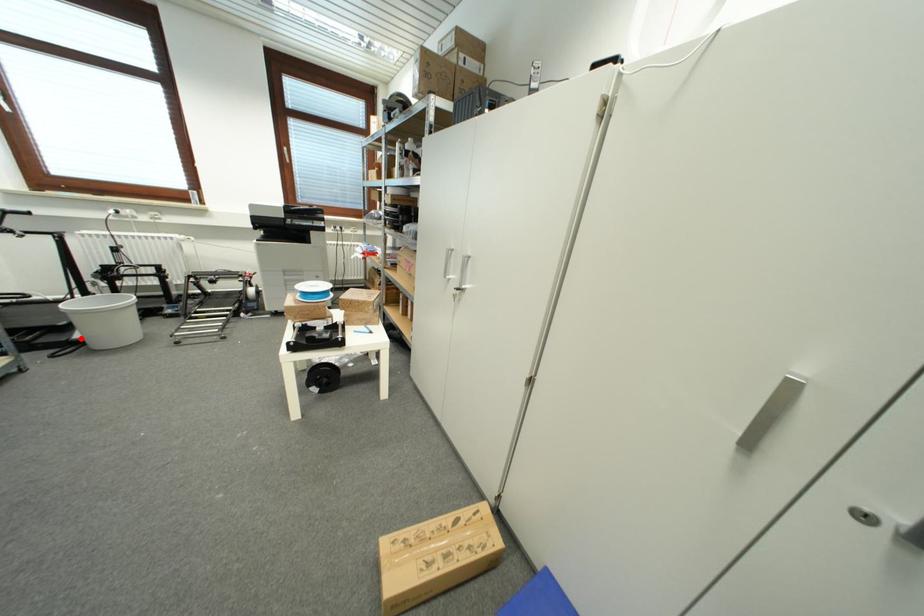
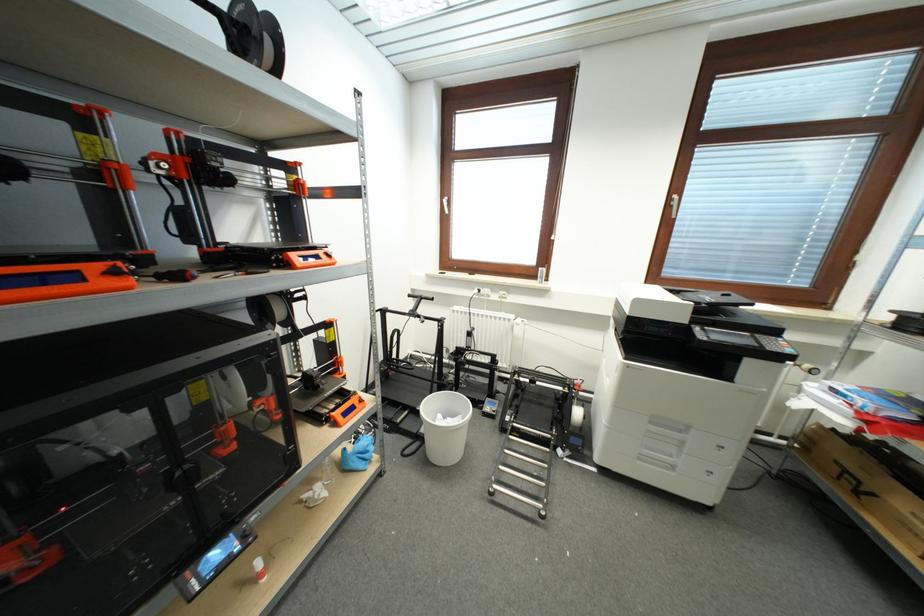
Question: I am providing you with two images of the same scene from different viewpoints. A red point is shown in image1. For the corresponding object point in image2, is it positioned nearer or farther from the camera?

Choices:
 (A) Nearer
 (B) Farther

Answer: (B)